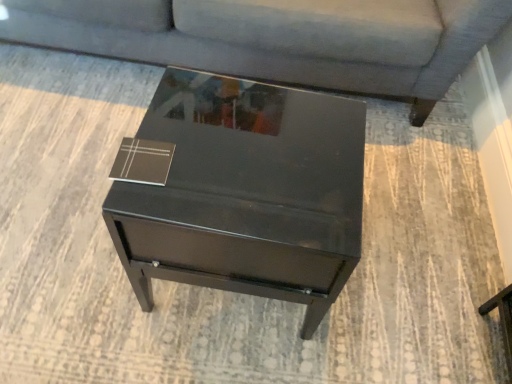
Question: Does point (327, 210) appear closer or farther from the camera than point (323, 41)?

Choices:
 (A) farther
 (B) closer

Answer: (B)

Question: Relative to matte gray couch at upper center, is glossy black table at center in front or behind?

Choices:
 (A) front
 (B) behind

Answer: (A)

Question: Which is nearer to the matte gray couch at upper center?

Choices:
 (A) brown leather book at upper left
 (B) glossy black table at center

Answer: (B)

Question: Which is farther from the matte gray couch at upper center?

Choices:
 (A) brown leather book at upper left
 (B) glossy black table at center

Answer: (A)